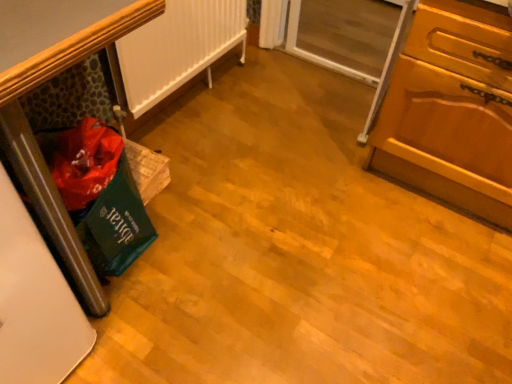
Locate an element on the screen. The height and width of the screenshot is (384, 512). vacant area to the left of wooden cabinet at right is located at coordinates (294, 155).